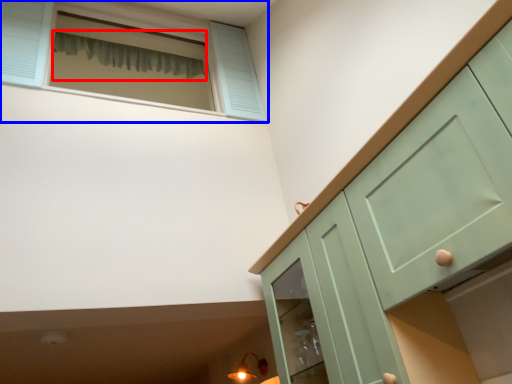
Question: Which object appears closest to the camera in this image, curtain (highlighted by a red box) or window (highlighted by a blue box)?

Choices:
 (A) curtain
 (B) window

Answer: (B)